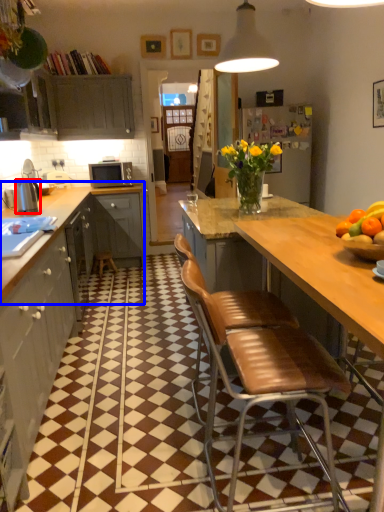
Question: Which object appears closest to the camera in this image, kitchen appliance (highlighted by a red box) or cabinetry (highlighted by a blue box)?

Choices:
 (A) kitchen appliance
 (B) cabinetry

Answer: (A)